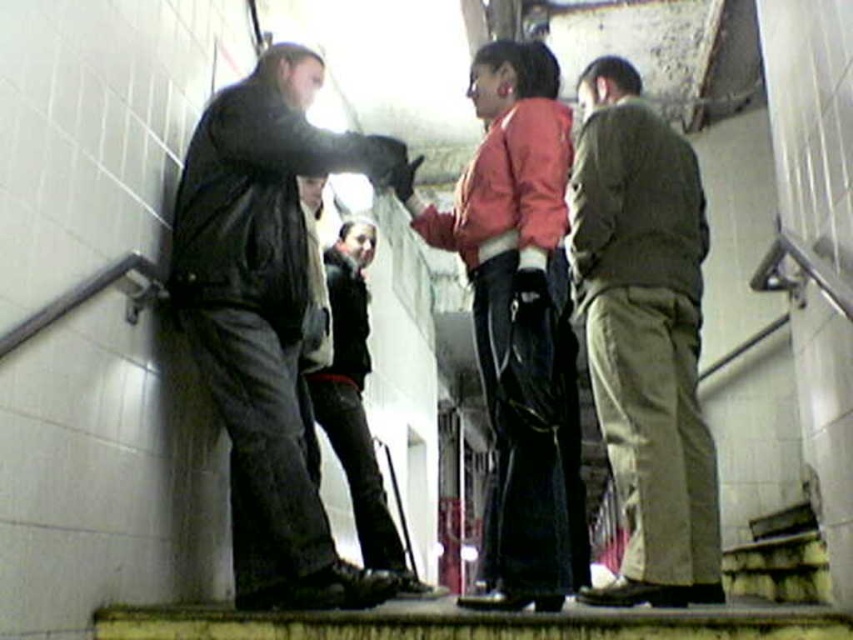
You are standing at the bottom of the staircase in the subway station and see two people wearing jackets at the center of the stairs. Which jacket is nearer to you, the matte pink jacket at center or the leather jacket at center?

The matte pink jacket at center is closer to the viewer than the leather jacket at center, so the matte pink jacket at center is nearer to you.

You are standing at the bottom of the staircase in the subway station. You see the matte black jacket at left and the matte pink jacket at center. Which person is closer to the bottom of the staircase?

The matte black jacket at left is located below the matte pink jacket at center, so the person wearing the matte black jacket at left is closer to the bottom of the staircase.